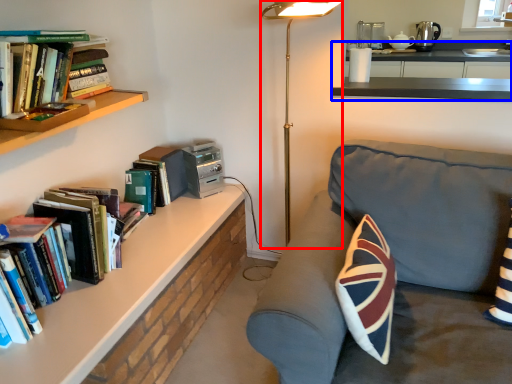
Question: Which point is further to the camera, table lamp (highlighted by a red box) or counter (highlighted by a blue box)?

Choices:
 (A) table lamp
 (B) counter

Answer: (B)